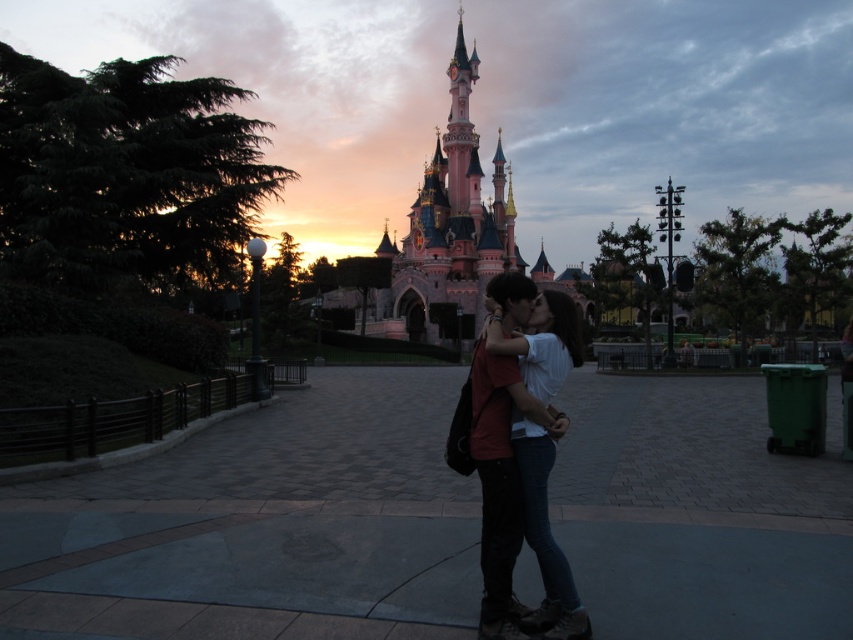
Question: Is matte black couple at center to the left of pink painted stone castle at center from the viewer's perspective?

Choices:
 (A) yes
 (B) no

Answer: (B)

Question: Does matte black couple at center have a smaller size compared to pink painted stone castle at center?

Choices:
 (A) yes
 (B) no

Answer: (A)

Question: Which of the following is the closest to the observer?

Choices:
 (A) pink painted stone castle at center
 (B) matte black couple at center

Answer: (B)

Question: Considering the relative positions of matte black couple at center and pink painted stone castle at center in the image provided, where is matte black couple at center located with respect to pink painted stone castle at center?

Choices:
 (A) left
 (B) right

Answer: (B)

Question: Which of the following is the closest to the observer?

Choices:
 (A) (486, 593)
 (B) (413, 228)

Answer: (A)